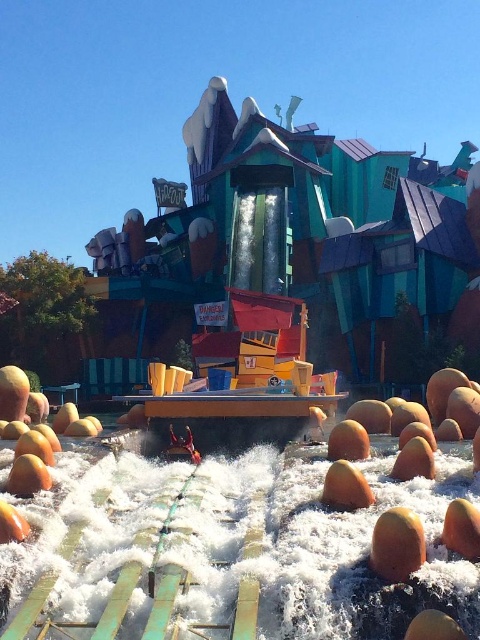
Based on the photo, you are standing at the entrance of the theme park attraction and want to locate two specific points marked on a map. The first point is labeled as point [298,528] and the second is point [415,544]. According to the scene description, which point is closer to you when facing the building?

Point [415,544] is closer to you because it is in front of point [298,528].